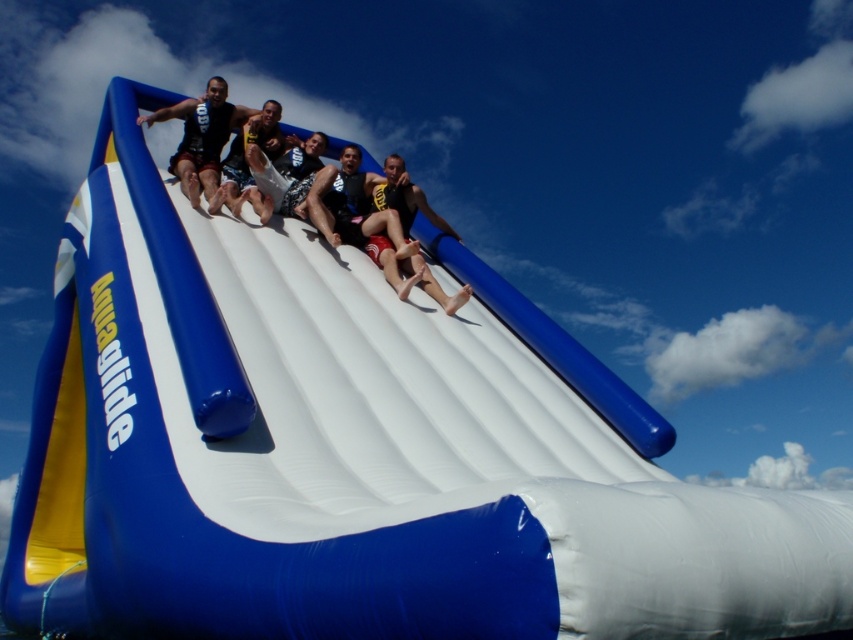
Question: Is matte black shorts at center wider than matte black wetsuit at center?

Choices:
 (A) yes
 (B) no

Answer: (A)

Question: Does matte black shorts at center have a lesser width compared to matte black wetsuit at center?

Choices:
 (A) yes
 (B) no

Answer: (B)

Question: Which of the following is the closest to the observer?

Choices:
 (A) (231, 122)
 (B) (321, 148)

Answer: (B)

Question: Is matte black shorts at center positioned behind matte black wetsuit at center?

Choices:
 (A) yes
 (B) no

Answer: (B)